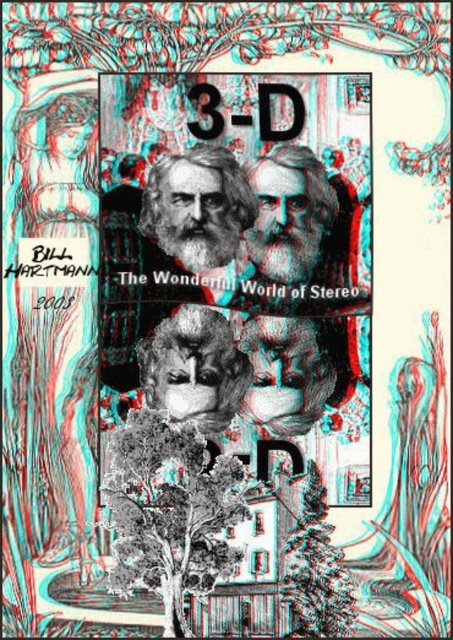
Who is positioned more to the left, white beard at center or gray beard at center?

gray beard at center is more to the left.

Can you confirm if white beard at center is thinner than gray beard at center?

Yes, white beard at center is thinner than gray beard at center.

Who is more forward, (298, 250) or (208, 212)?

Point (208, 212)

The image size is (453, 640). I want to click on white beard at center, so click(298, 228).

Does gray beard at center appear over green matte tree at lower center?

Correct, gray beard at center is located above green matte tree at lower center.

Is gray beard at center to the right of green matte tree at lower center from the viewer's perspective?

No, gray beard at center is not to the right of green matte tree at lower center.

Find the location of a particular element. gray beard at center is located at coordinates (200, 212).

Can you confirm if white beard at center is positioned below green matte tree at lower center?

No, white beard at center is not below green matte tree at lower center.

Based on the photo, who is taller, white beard at center or green matte tree at lower center?

Standing taller between the two is green matte tree at lower center.

Between point (345, 289) and point (326, 625), which one is positioned in front?

Positioned in front is point (326, 625).

This screenshot has height=640, width=453. I want to click on white beard at center, so click(x=298, y=228).